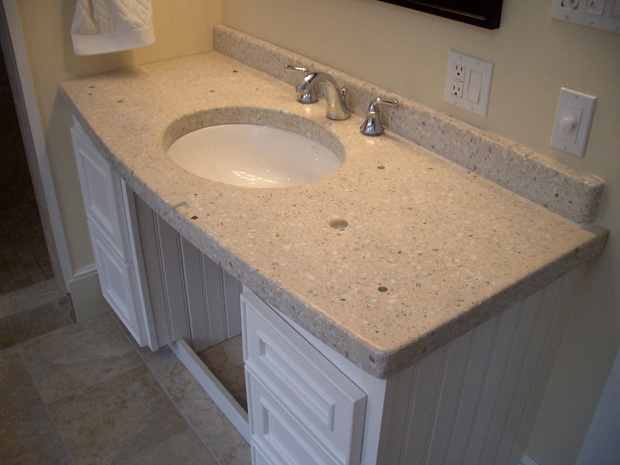
Locate an element on the screen. sink faucet is located at coordinates (334, 98).